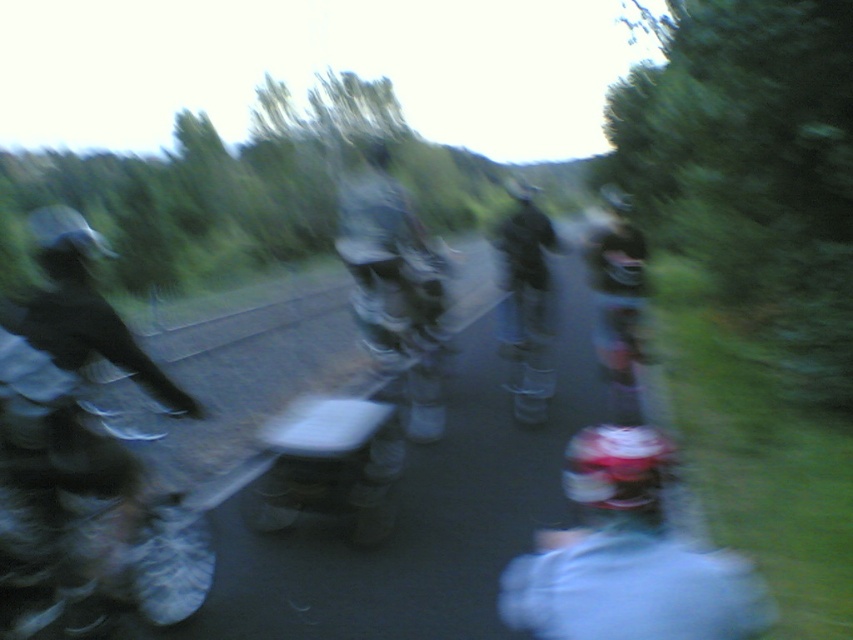
You are a photographer trying to capture a clear shot of the white matte helmet at center and the metallic silver motorcycle at left. Since the image is slightly blurred, you want to adjust your focus. Which object should you focus on first to ensure it appears sharp in the final photo?

The white matte helmet at center is behind the metallic silver motorcycle at left. To ensure both appear sharp, focus on the metallic silver motorcycle at left first since it is closer to you, then adjust focus towards the white matte helmet at center as it is further away.

You are a photographer trying to capture a clear shot of the metallic silver motorcycle at left and the white matte helmet at center. Since the scene is slightly blurred, you need to adjust your focus. Which object is narrower so you can focus on it first?

The metallic silver motorcycle at left is thinner than the white matte helmet at center, so you can focus on the metallic silver motorcycle at left first since it is narrower.

You are standing in the scene and want to move from the point at coordinates point (15, 371) to the point at coordinates point (663, 616). Which direction should you move relative to the camera perspective?

You should move downward and to the right relative to the camera perspective because point (663, 616) is located at a lower and rightward position compared to point (15, 371).